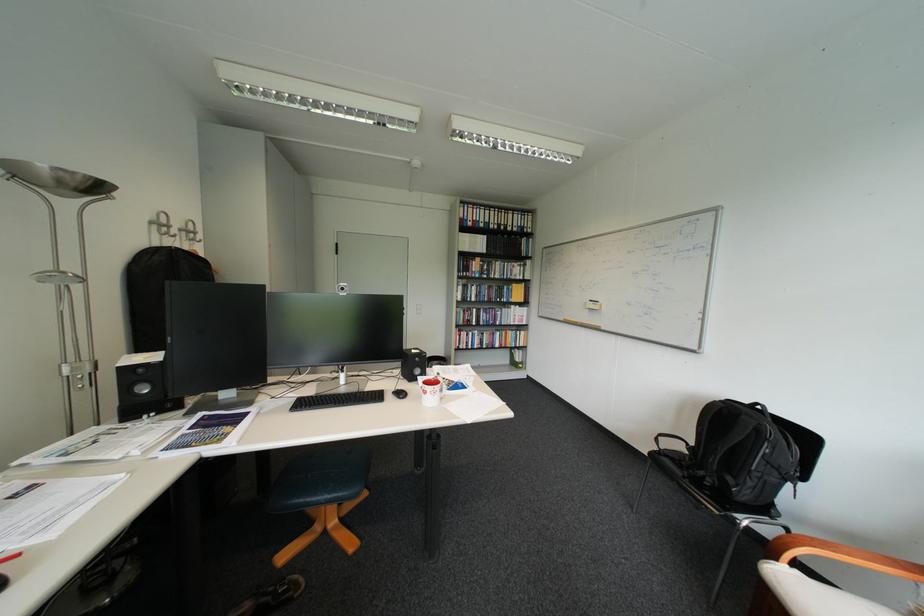
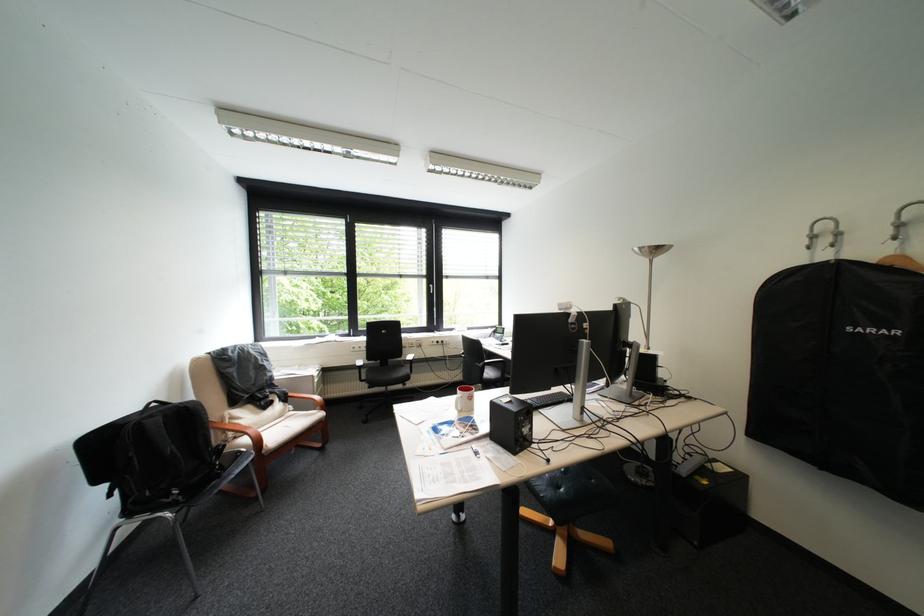
Locate, in the second image, the point that corresponds to [756,418] in the first image.

(199, 407)